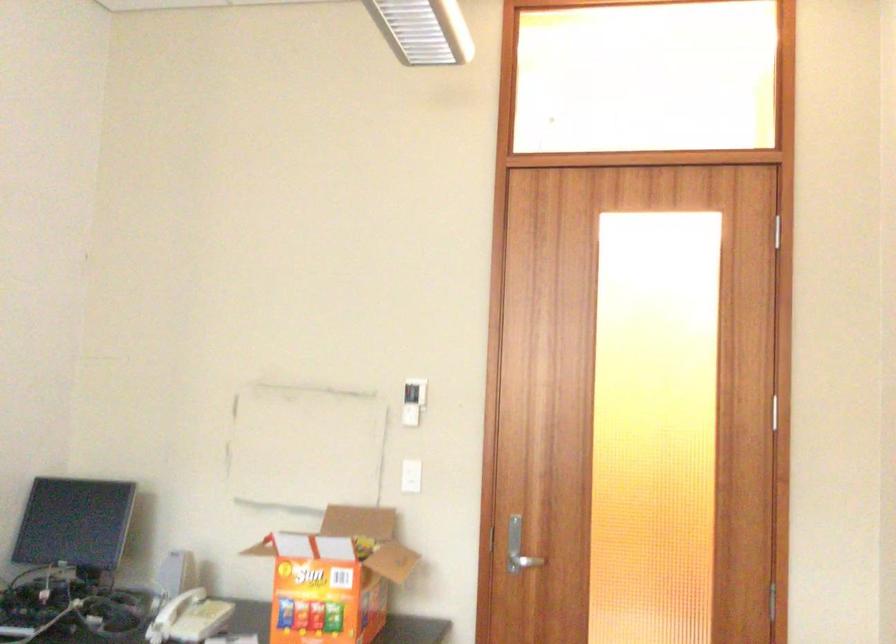
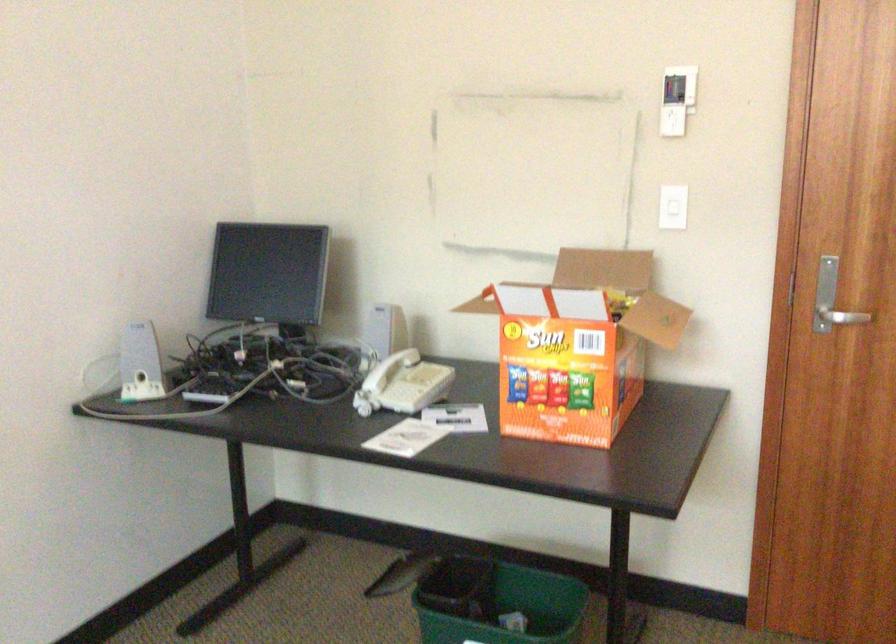
Locate, in the second image, the point that corresponds to (x=522, y=564) in the first image.

(842, 317)